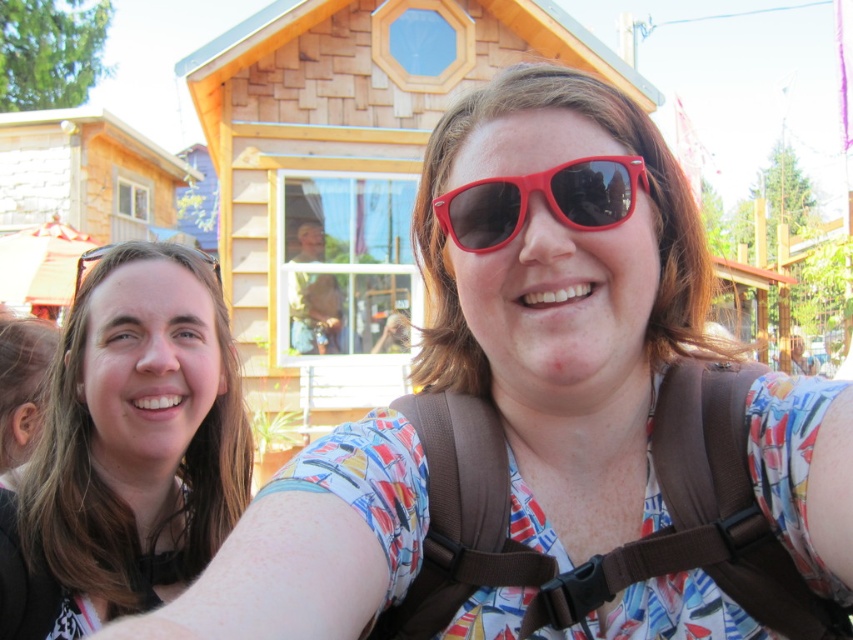
Question: Which of the following is the farthest from the observer?

Choices:
 (A) red plastic sunglasses at center
 (B) brown fabric strap at center
 (C) matte black hair at left

Answer: (C)

Question: Estimate the real-world distances between objects in this image. Which object is farther from the brown fabric strap at center?

Choices:
 (A) matte black sunglasses at left
 (B) red plastic sunglasses at center

Answer: (A)

Question: Can you confirm if red plastic sunglasses at center is positioned to the right of matte black sunglasses at left?

Choices:
 (A) no
 (B) yes

Answer: (B)

Question: Which point is closer to the camera?

Choices:
 (A) (166, 516)
 (B) (82, 260)
 (C) (461, 243)
 (D) (392, 16)

Answer: (C)

Question: Is wooden cabin at center further to camera compared to matte black sunglasses at left?

Choices:
 (A) yes
 (B) no

Answer: (A)

Question: Is matte black hair at left bigger than red plastic sunglasses at center?

Choices:
 (A) yes
 (B) no

Answer: (A)